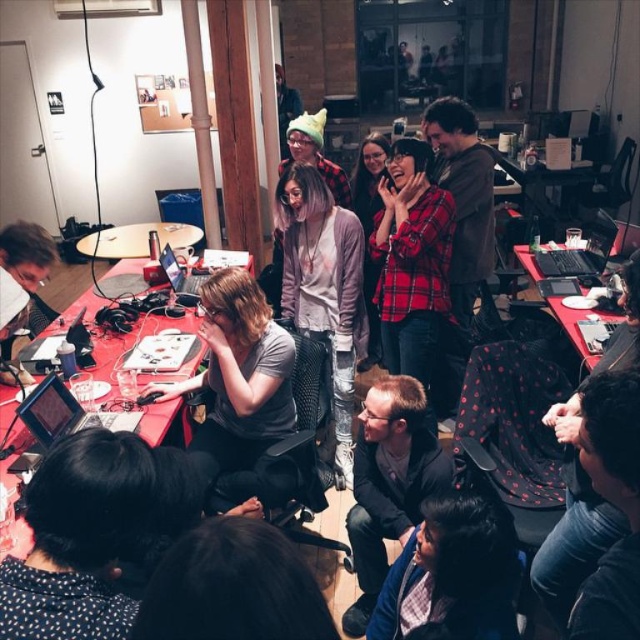
You are organizing a meeting in this office space and need to place a 1.5 meter tall standing plant next to the tables. Considering the height of the smooth wooden table at center and the black plastic table at center, which table would be better to place the plant next to so it doesn

The smooth wooden table at center is shorter than the black plastic table at center. Therefore, placing the 1.5 meter tall standing plant next to the black plastic table at center would be better, as the plant will be more proportionate in height compared to the taller table.

You are standing in the office scene and want to reach both the point at coordinates [100,241] and the point at coordinates [577,337]. Which point will you reach first if you move straight towards them?

You will reach the point at coordinates [100,241] first because it is closer to you than the point at coordinates [577,337], which is further away.

You are a delivery person who needs to place a small package on the desk in this office scene. The package must be placed on the surface where the black matte laptop at upper right is located. Can you place the package next to the dark blue fabric jacket at lower center without moving the jacket?

The dark blue fabric jacket at lower center is positioned under the black matte laptop at upper right, meaning the jacket is below the laptop on the desk. Since the jacket is already under the laptop, there might not be enough space next to it on the same surface. You may need to adjust the placement carefully or choose another spot on the desk.